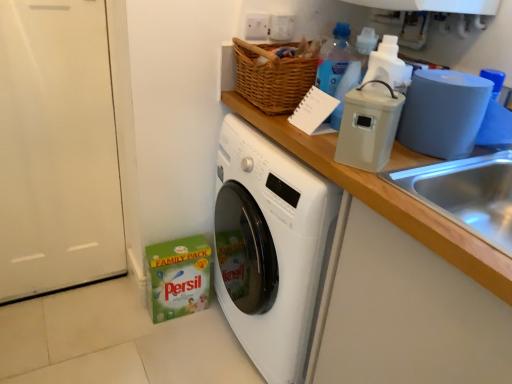
Question: From the image's perspective, would you say wooden at upper right is positioned over blue translucent bottle at upper center, which appears as the second bottle when ordered from the bottom?

Choices:
 (A) yes
 (B) no

Answer: (B)

Question: From a real-world perspective, is wooden at upper right on top of blue translucent bottle at upper center, which is the 2th bottle in front-to-back order?

Choices:
 (A) no
 (B) yes

Answer: (A)

Question: From a real-world perspective, is wooden at upper right under blue translucent bottle at upper center, which is the 2th bottle in front-to-back order?

Choices:
 (A) no
 (B) yes

Answer: (B)

Question: Considering the relative sizes of wooden at upper right and blue translucent bottle at upper center, placed as the 1th bottle when sorted from top to bottom, in the image provided, is wooden at upper right wider than blue translucent bottle at upper center, placed as the 1th bottle when sorted from top to bottom,?

Choices:
 (A) no
 (B) yes

Answer: (B)

Question: Is wooden at upper right shorter than blue translucent bottle at upper center, arranged as the first bottle when viewed from the back?

Choices:
 (A) no
 (B) yes

Answer: (A)

Question: Would you say wooden at upper right is to the left or to the right of blue matte toilet paper at right in the picture?

Choices:
 (A) right
 (B) left

Answer: (B)

Question: From a real-world perspective, is wooden at upper right positioned above or below blue matte toilet paper at right?

Choices:
 (A) below
 (B) above

Answer: (A)

Question: In terms of height, does wooden at upper right look taller or shorter compared to blue matte toilet paper at right?

Choices:
 (A) tall
 (B) short

Answer: (A)

Question: Based on their sizes in the image, would you say wooden at upper right is bigger or smaller than blue matte toilet paper at right?

Choices:
 (A) big
 (B) small

Answer: (A)

Question: Looking at their shapes, would you say blue matte toilet paper at right is wider or thinner than beige plastic container at upper right?

Choices:
 (A) thin
 (B) wide

Answer: (B)

Question: Is blue matte toilet paper at right in front of or behind beige plastic container at upper right in the image?

Choices:
 (A) front
 (B) behind

Answer: (B)

Question: Considering the relative positions of blue matte toilet paper at right and beige plastic container at upper right in the image provided, is blue matte toilet paper at right to the left or to the right of beige plastic container at upper right?

Choices:
 (A) left
 (B) right

Answer: (B)

Question: From the image's perspective, is blue matte toilet paper at right located above or below beige plastic container at upper right?

Choices:
 (A) below
 (B) above

Answer: (B)

Question: Is point (349, 29) positioned closer to the camera than point (473, 261)?

Choices:
 (A) farther
 (B) closer

Answer: (A)

Question: In the image, is blue translucent bottle at upper center, which appears as the second bottle when ordered from the bottom, on the left side or the right side of wooden at upper right?

Choices:
 (A) right
 (B) left

Answer: (A)